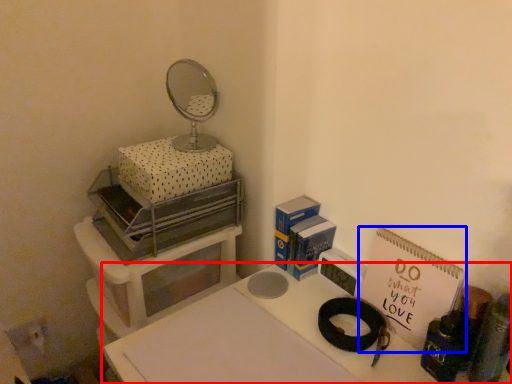
Question: Which object is closer to the camera taking this photo, table (highlighted by a red box) or notebook (highlighted by a blue box)?

Choices:
 (A) table
 (B) notebook

Answer: (A)